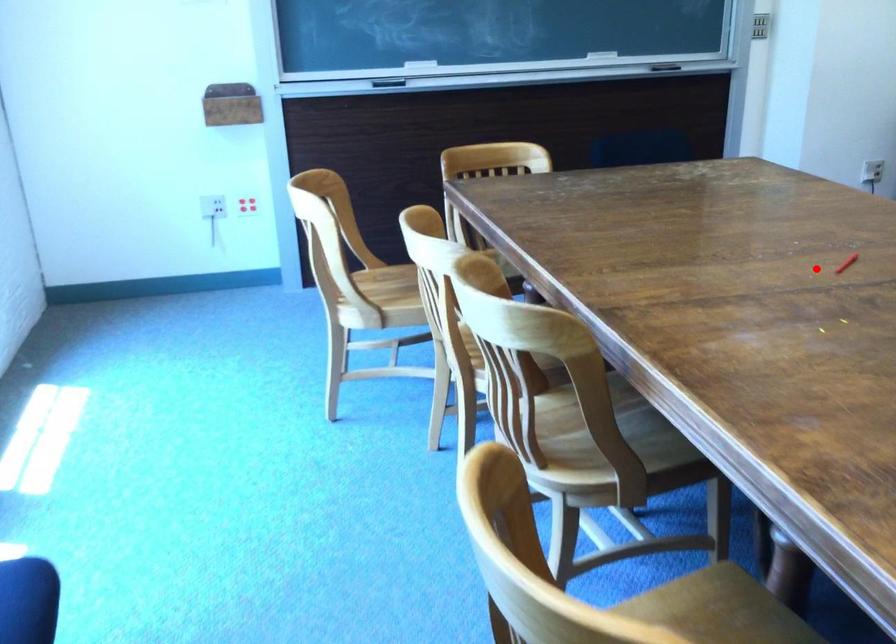
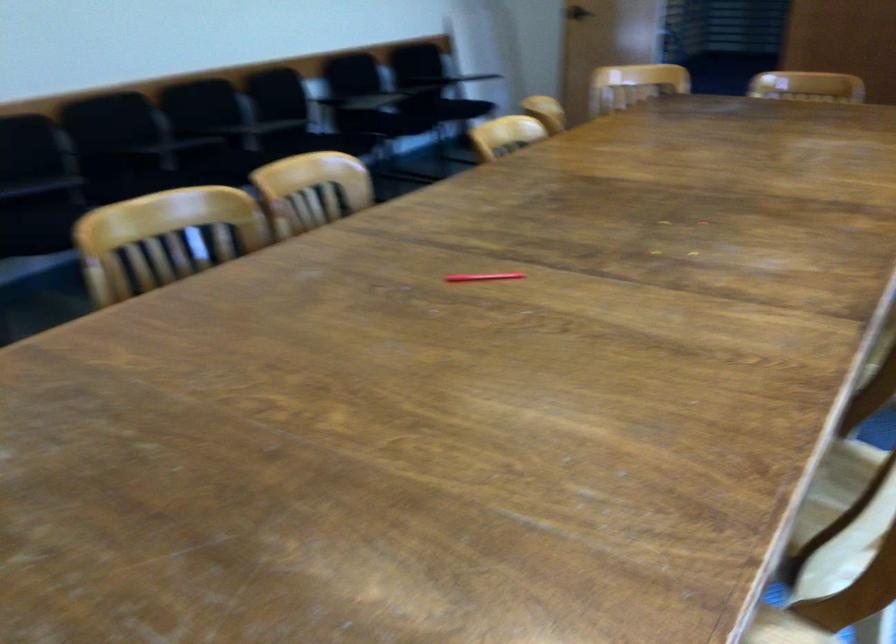
Question: I am providing you with two images of the same scene from different viewpoints. In image1, a red point is highlighted. Considering the same 3D point in image2, which of the following is correct?

Choices:
 (A) It is closer
 (B) It is farther

Answer: (A)